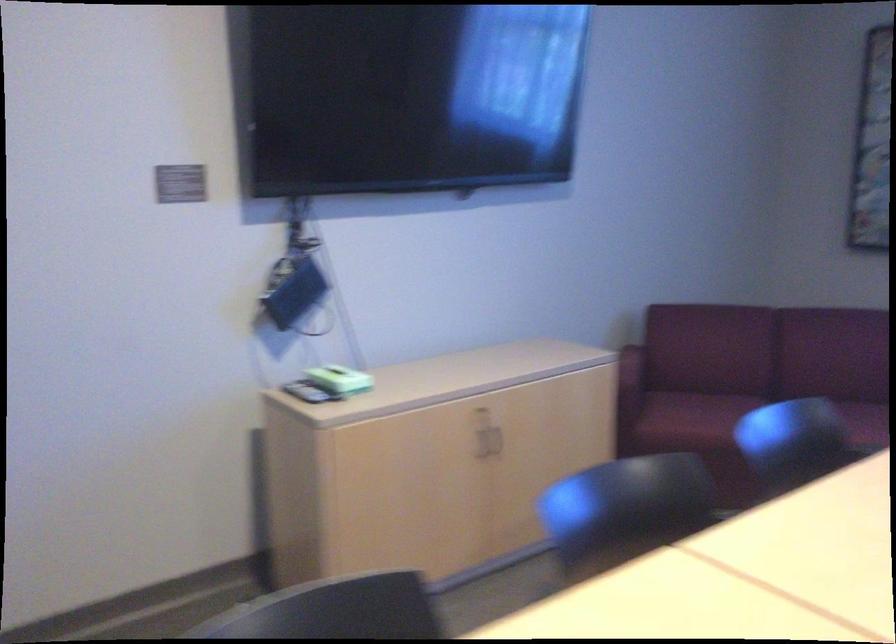
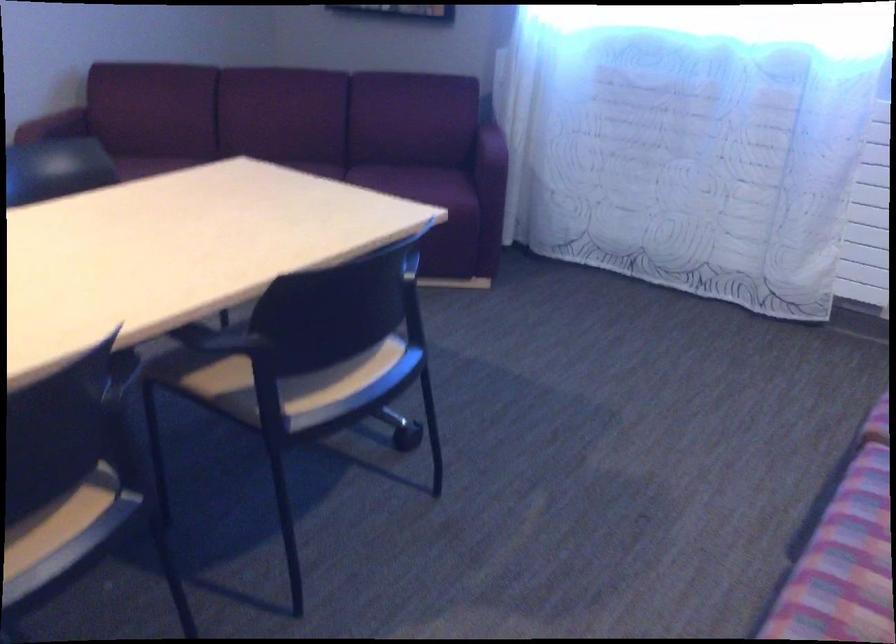
In the second image, find the point that corresponds to point (655, 368) in the first image.

(54, 125)